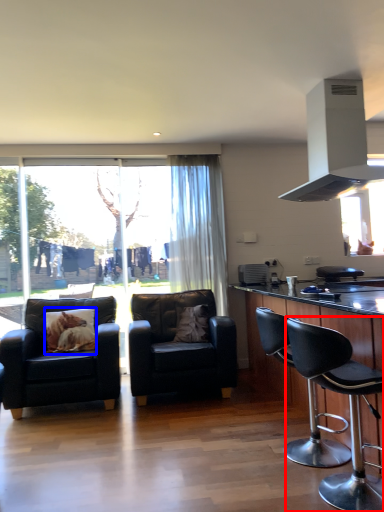
Question: Which object is further to the camera taking this photo, chair (highlighted by a red box) or pillow (highlighted by a blue box)?

Choices:
 (A) chair
 (B) pillow

Answer: (B)